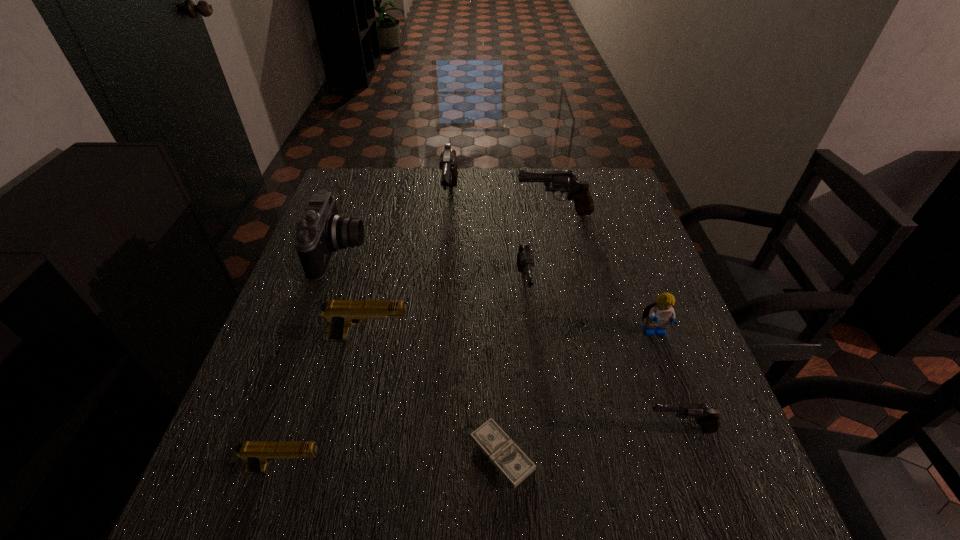
The height and width of the screenshot is (540, 960). I want to click on object that is at the far right corner, so click(x=564, y=181).

What are the coordinates of `free space at the far edge` in the screenshot? It's located at (538, 173).

This screenshot has width=960, height=540. Identify the location of vacant space at the near edge. (462, 487).

The width and height of the screenshot is (960, 540). Identify the location of vacant point at the left edge. (299, 473).

In the image, there is a desktop. At what (x,y) coordinates should I click in order to perform the action: click on blank space at the right edge. Please return your answer as a coordinate pair (x, y). Looking at the image, I should click on (647, 294).

Identify the location of free space at the far left corner. (340, 187).

At what (x,y) coordinates should I click in order to perform the action: click on vacant space at the near left corner. Please return your answer as a coordinate pair (x, y). The height and width of the screenshot is (540, 960). Looking at the image, I should click on (195, 536).

Locate an element on the screen. vacant space at the far right corner of the desktop is located at coordinates (615, 200).

This screenshot has height=540, width=960. In order to click on free space that is in between the Lego and the black camera in this screenshot , I will do `click(497, 293)`.

Where is `vacant area that lies between the smaller tan pistol and the third biggest gray pistol`? The image size is (960, 540). vacant area that lies between the smaller tan pistol and the third biggest gray pistol is located at coordinates (406, 378).